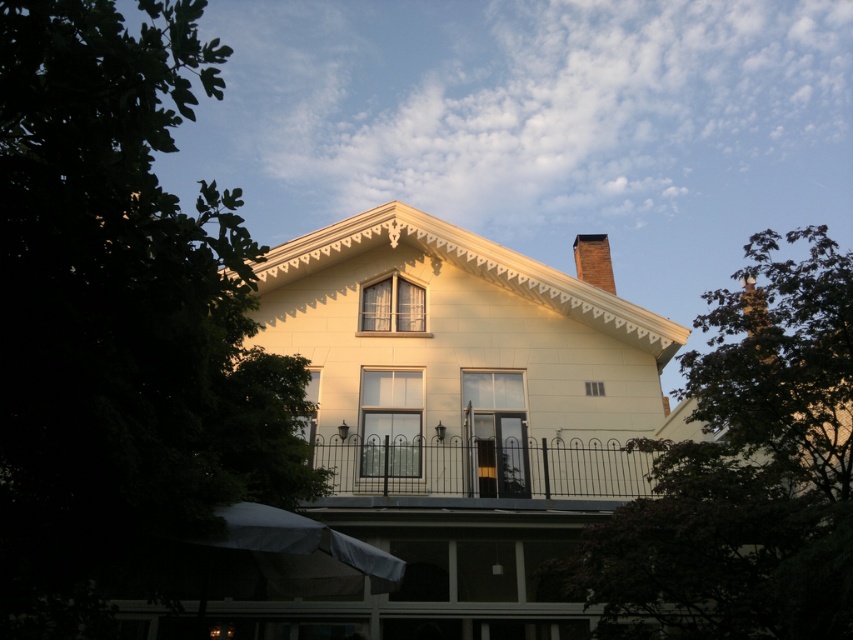
Question: Is green leafy tree at left bigger than black metal fence at center?

Choices:
 (A) yes
 (B) no

Answer: (A)

Question: Which of the following is the closest to the observer?

Choices:
 (A) (35, 8)
 (B) (589, 474)
 (C) (785, 544)

Answer: (A)

Question: Which of these objects is positioned farthest from the black metal fence at center?

Choices:
 (A) green leafy tree at upper right
 (B) green leafy tree at left

Answer: (B)

Question: Which object appears closest to the camera in this image?

Choices:
 (A) black metal fence at center
 (B) green leafy tree at left

Answer: (B)

Question: Does green leafy tree at left appear on the right side of black metal fence at center?

Choices:
 (A) yes
 (B) no

Answer: (B)

Question: Is green leafy tree at left above green leafy tree at upper right?

Choices:
 (A) no
 (B) yes

Answer: (B)